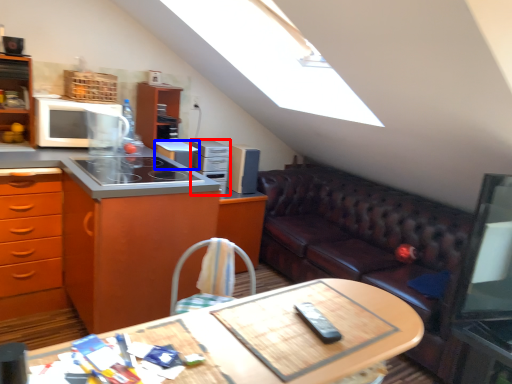
Question: Which object is closer to the camera taking this photo, appliance (highlighted by a red box) or appliance (highlighted by a blue box)?

Choices:
 (A) appliance
 (B) appliance

Answer: (B)